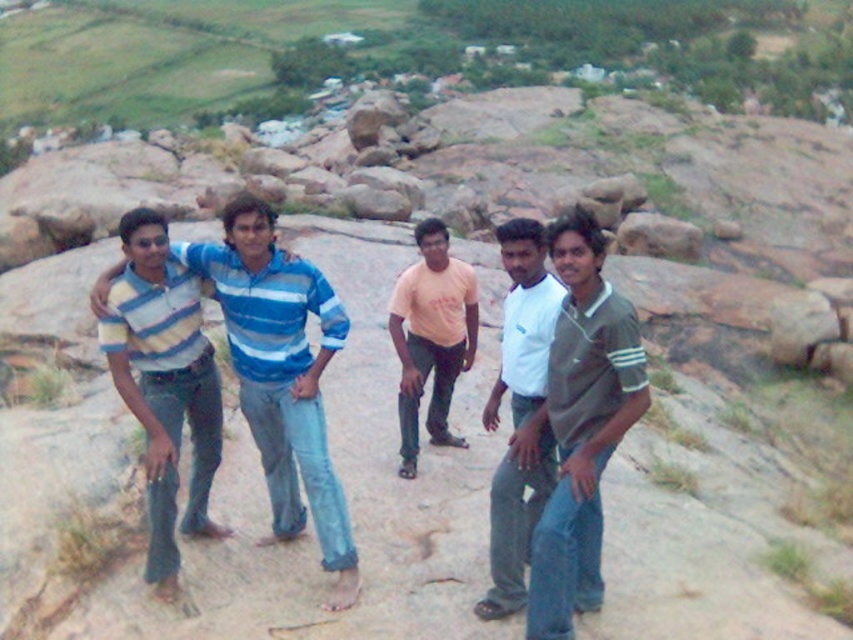
Question: Which of the following is the farthest from the observer?

Choices:
 (A) (167, 376)
 (B) (460, 324)
 (C) (297, 401)
 (D) (518, 307)

Answer: (B)

Question: Can you confirm if striped cotton shirt at center is positioned above striped cotton shirt at left?

Choices:
 (A) yes
 (B) no

Answer: (A)

Question: Is white cotton shirt at center to the right of orange t-shirt at center from the viewer's perspective?

Choices:
 (A) yes
 (B) no

Answer: (A)

Question: Which is nearer to the striped cotton shirt at center?

Choices:
 (A) striped cotton shirt at left
 (B) orange t-shirt at center

Answer: (A)

Question: Which object is the farthest from the dark green polo shirt at center?

Choices:
 (A) orange t-shirt at center
 (B) white cotton shirt at center

Answer: (A)

Question: Can you confirm if striped cotton shirt at center is bigger than striped cotton shirt at left?

Choices:
 (A) no
 (B) yes

Answer: (B)